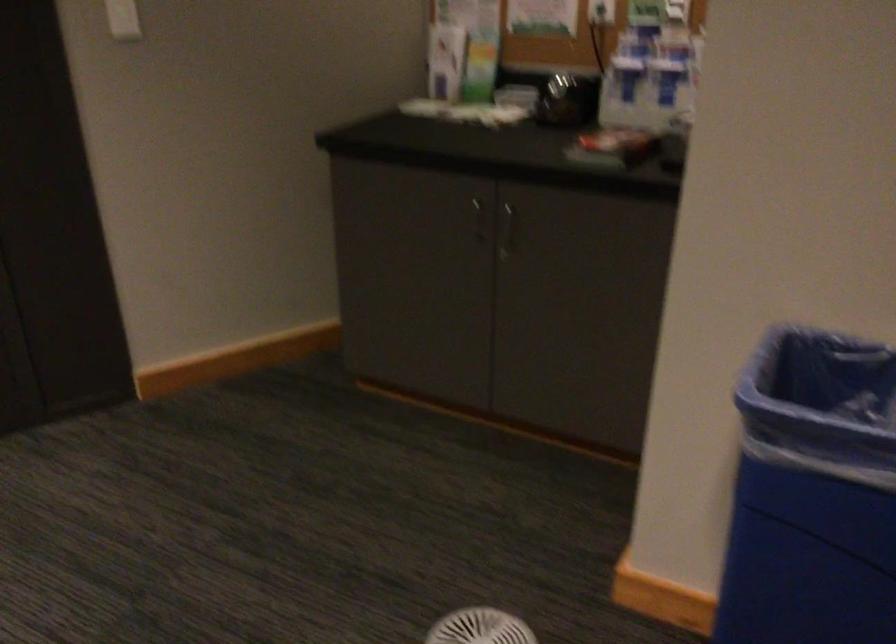
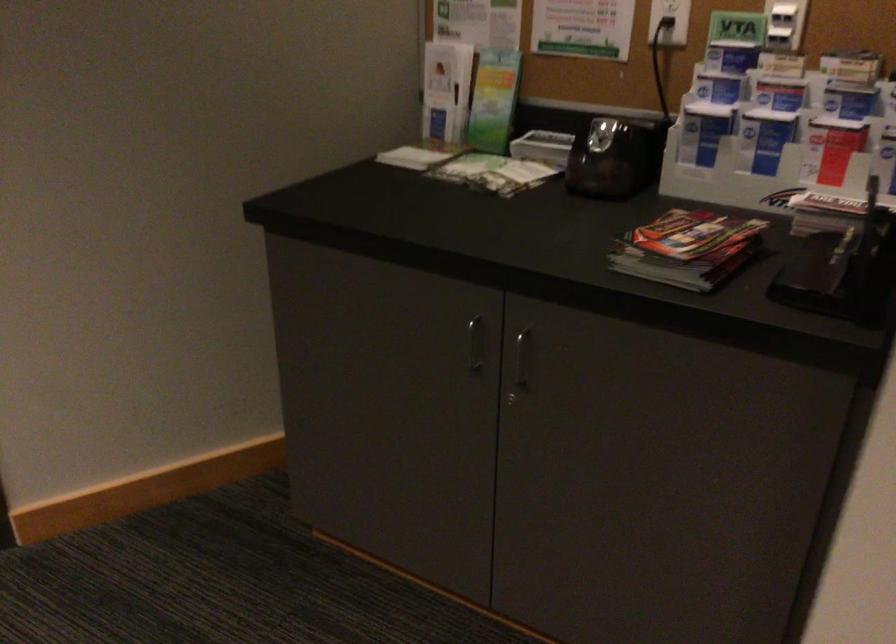
Find the pixel in the second image that matches point 511,223 in the first image.

(521, 357)